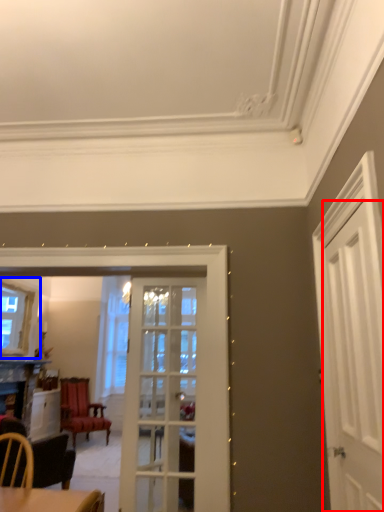
Question: Among these objects, which one is farthest to the camera, door (highlighted by a red box) or window (highlighted by a blue box)?

Choices:
 (A) door
 (B) window

Answer: (B)